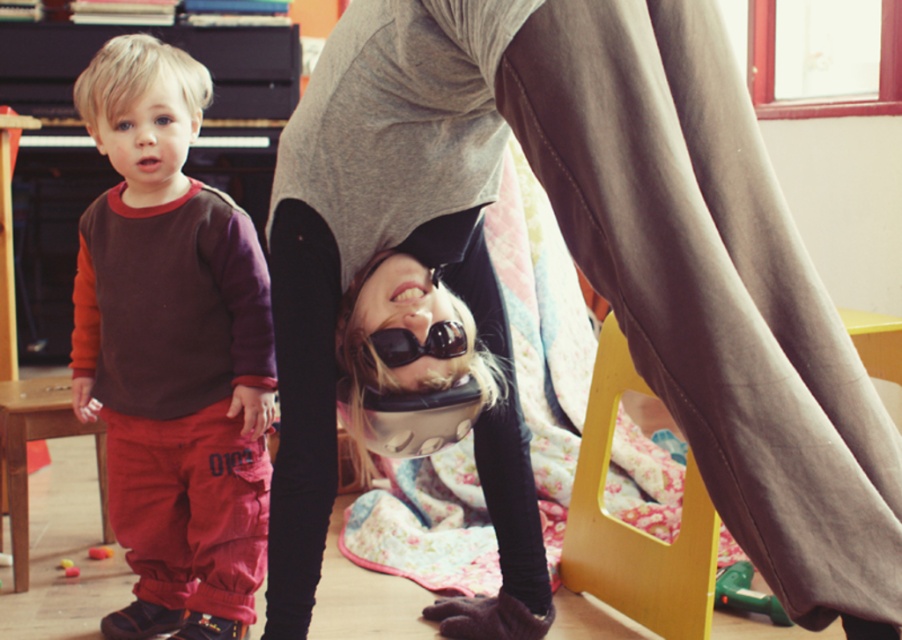
Can you confirm if gray fabric pants at center is positioned below rubberized yellow toy at lower left?

No.

Which is in front, point (502, 109) or point (91, 548)?

Positioned in front is point (502, 109).

The height and width of the screenshot is (640, 902). I want to click on gray fabric pants at center, so click(x=587, y=264).

Is gray fabric pants at center positioned before black matte goggles at center?

Yes, it is in front of black matte goggles at center.

Is point (470, 24) positioned after point (413, 356)?

No.

Where is `gray fabric pants at center`? gray fabric pants at center is located at coordinates (587, 264).

Identify the location of gray fabric pants at center. The width and height of the screenshot is (902, 640). (587, 264).

Between point (804, 310) and point (129, 634), which one is positioned behind?

The point (129, 634) is more distant.

The height and width of the screenshot is (640, 902). In order to click on gray fabric pants at center in this screenshot , I will do `click(587, 264)`.